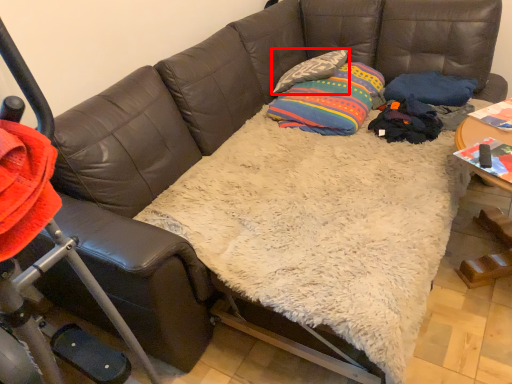
Question: From the image's perspective, where is pillow (annotated by the red box) located in relation to throw pillow in the image?

Choices:
 (A) above
 (B) below

Answer: (A)